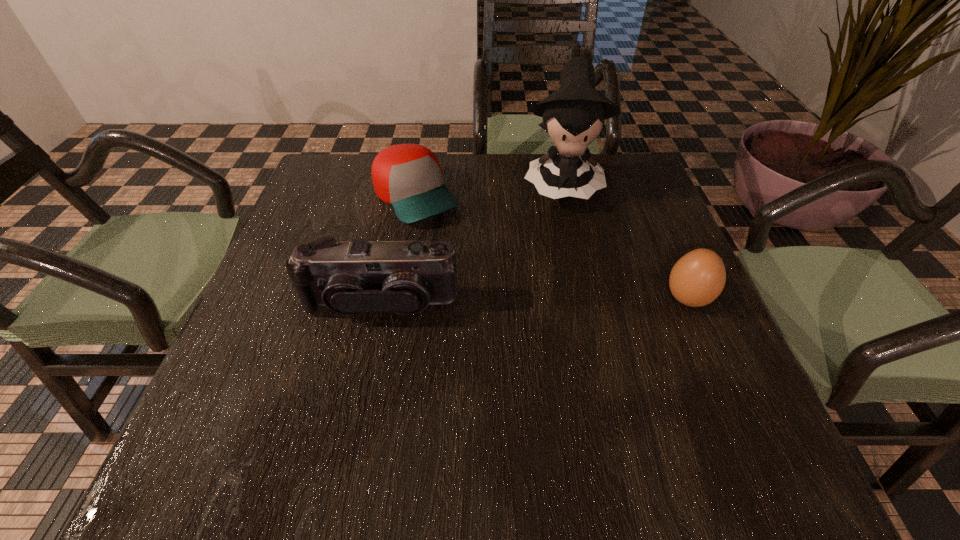
Where is `free region located at the brim of the baseball cap`? The image size is (960, 540). free region located at the brim of the baseball cap is located at coordinates (466, 262).

Find the location of a particular element. This screenshot has height=540, width=960. free space located 0.120m at the brim of the baseball cap is located at coordinates (460, 254).

At what (x,y) coordinates should I click in order to perform the action: click on vacant space located at the brim of the baseball cap. Please return your answer as a coordinate pair (x, y). This screenshot has height=540, width=960. Looking at the image, I should click on (526, 333).

What are the coordinates of `doll that is at the far edge` in the screenshot? It's located at tap(573, 115).

Identify the location of baseball cap located in the far edge section of the desktop. (408, 177).

Locate an element on the screen. The image size is (960, 540). object that is at the left edge is located at coordinates coord(350,278).

The image size is (960, 540). I want to click on boiled egg located in the right edge section of the desktop, so click(697, 279).

The image size is (960, 540). In order to click on doll present at the right edge in this screenshot , I will do `click(573, 115)`.

Image resolution: width=960 pixels, height=540 pixels. I want to click on object that is at the far right corner, so click(573, 115).

The width and height of the screenshot is (960, 540). In order to click on free space at the far edge of the desktop in this screenshot , I will do `click(491, 182)`.